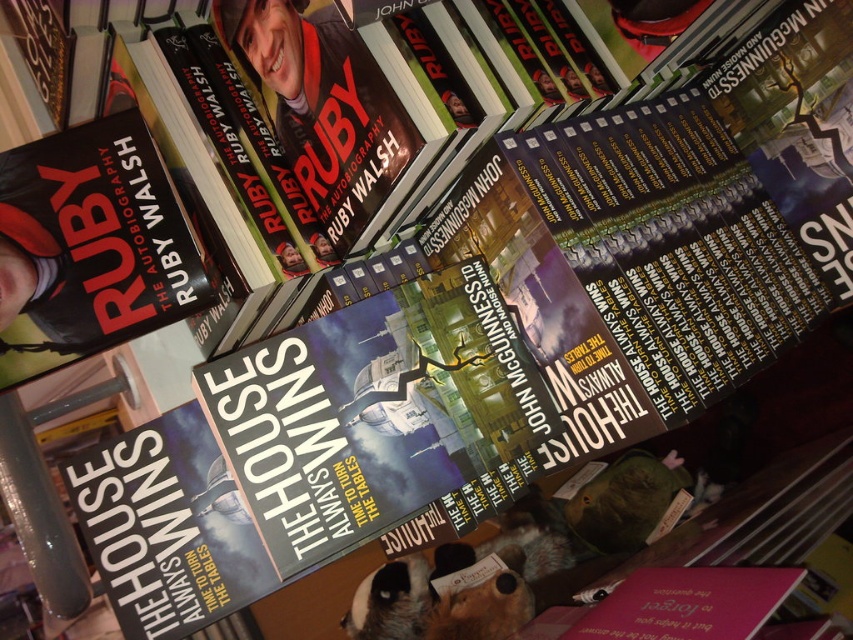
Is matte black book at upper left smaller than hardcover book at center?

No.

Looking at this image, measure the distance between matte black book at upper left and hardcover book at center.

matte black book at upper left and hardcover book at center are 9.95 inches apart from each other.

What do you see at coordinates (90, 246) in the screenshot?
I see `matte black book at upper left` at bounding box center [90, 246].

Locate an element on the screen. matte black book at upper left is located at coordinates [x=90, y=246].